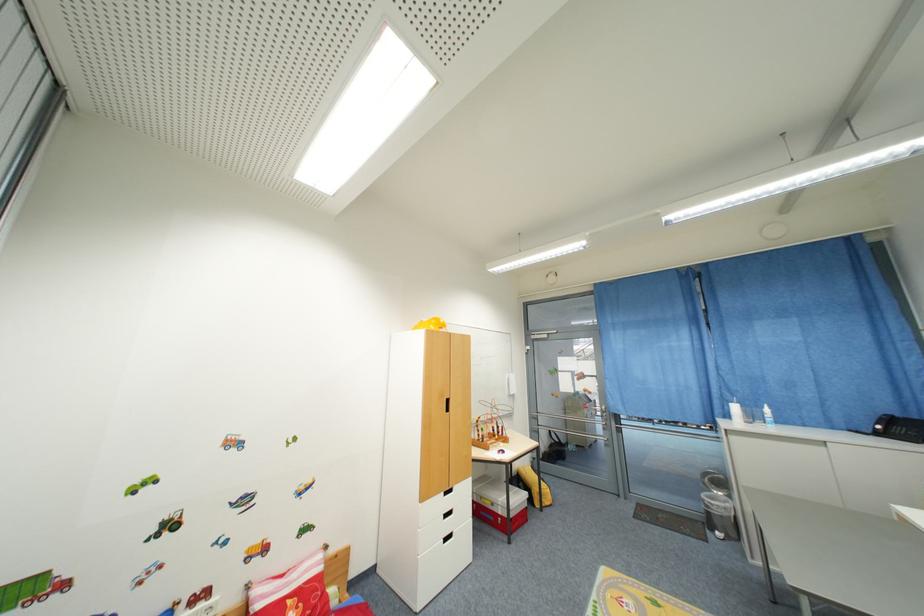
The image size is (924, 616). Identify the location of red and white box. (497, 504).